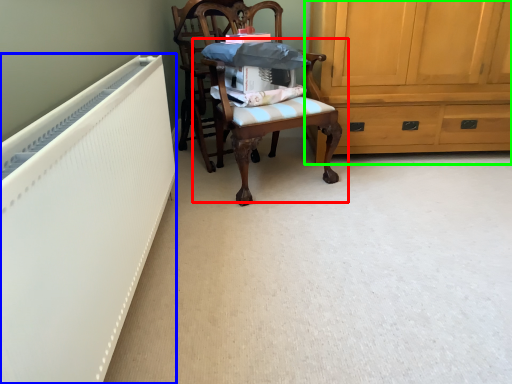
Question: Considering the real-world distances, which object is closest to chair (highlighted by a red box)? radiator (highlighted by a blue box) or cabinetry (highlighted by a green box).

Choices:
 (A) radiator
 (B) cabinetry

Answer: (B)